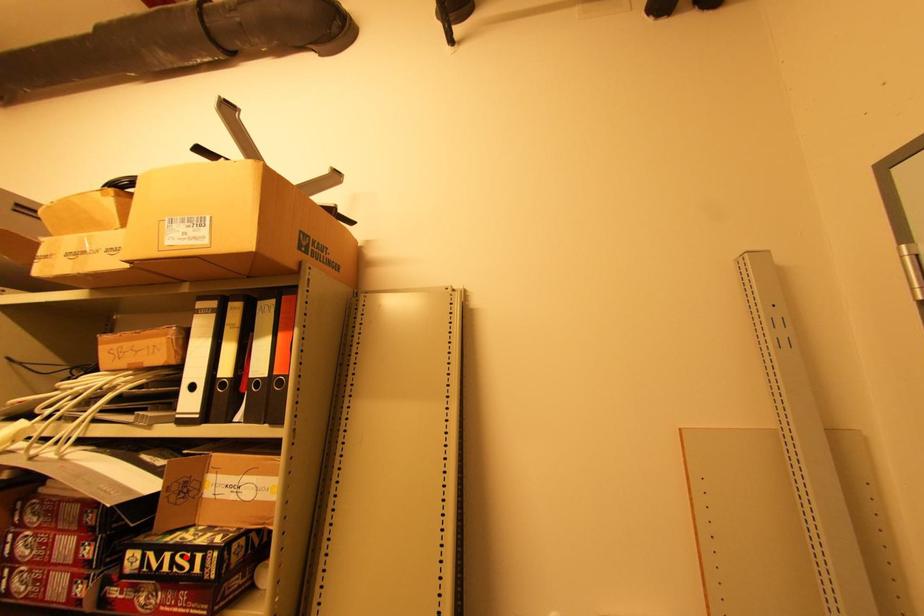
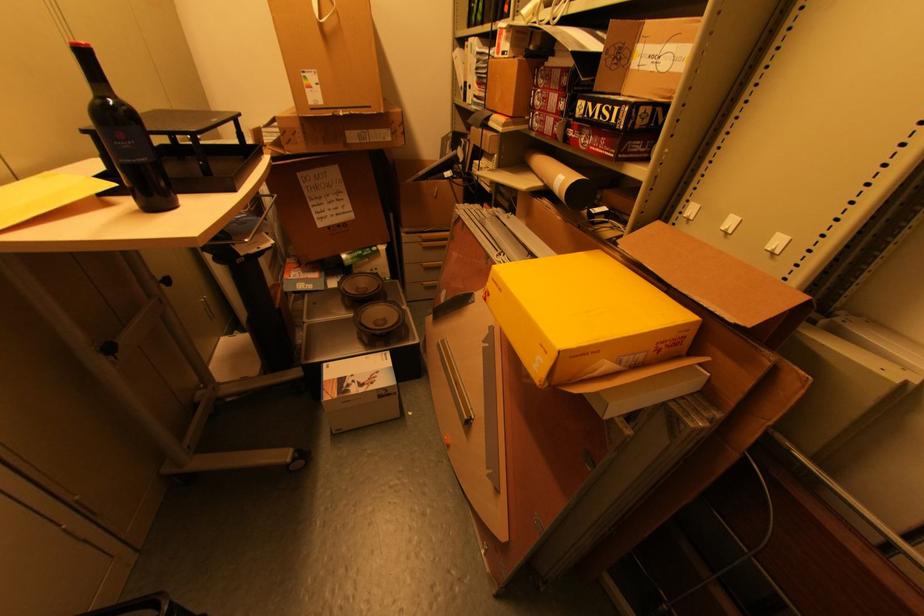
Where in the second image is the point corresponding to the highlighted location from the first image?

(610, 108)